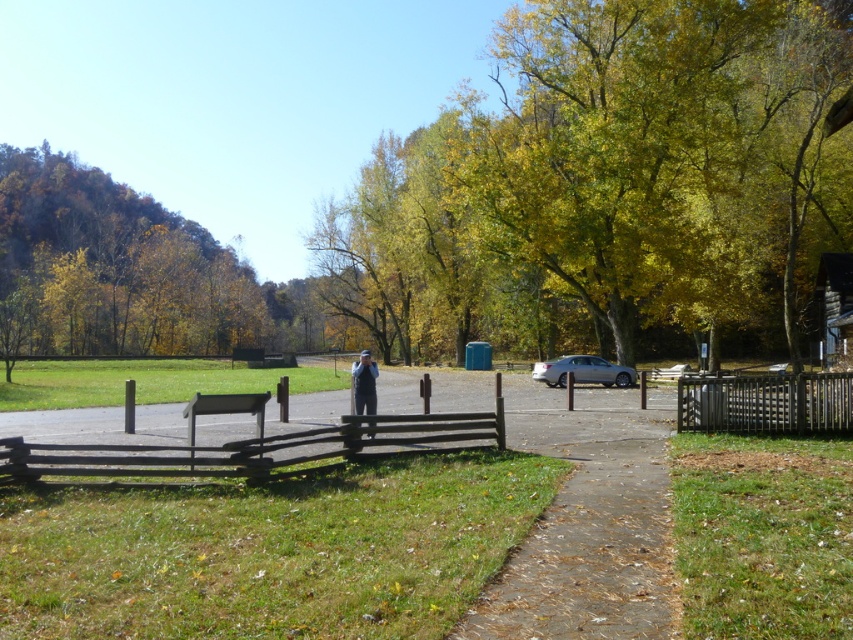
You are standing at the wooden fence in the lower left corner of the image and want to walk to the gravelly concrete path represented by point (587,520). Which direction should you head?

You should head towards the center of the image from the wooden fence in the lower left corner to reach the gravelly concrete path represented by point (587,520).

You are standing at the bottom right corner of the image, where the paved pathway begins. You want to walk directly towards the green leafy trees at upper left. Which direction should you head?

To reach the green leafy trees at upper left from the bottom right corner, you should head diagonally towards the upper left direction since their 2D location is at point [115,266].